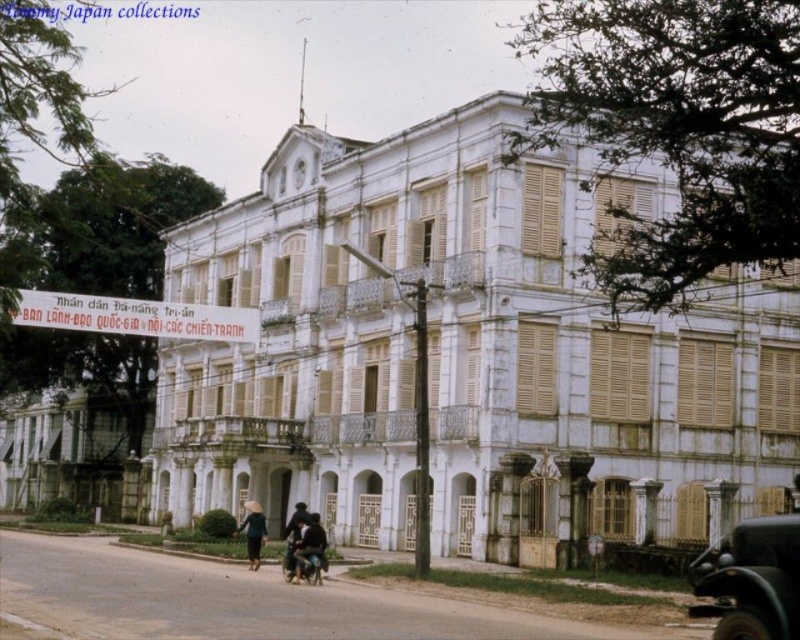
Question: Among these objects, which one is farthest from the camera?

Choices:
 (A) dark blue fabric hat at lower center
 (B) dark blue fabric jacket at center

Answer: (A)

Question: Observing the image, what is the correct spatial positioning of shiny black car at lower right in reference to dark blue fabric hat at lower center?

Choices:
 (A) below
 (B) above

Answer: (B)

Question: Is dark blue fabric jacket at center to the right of dark blue fabric hat at lower center from the viewer's perspective?

Choices:
 (A) yes
 (B) no

Answer: (A)

Question: Is white painted wood palace at center to the left of dark blue fabric hat at lower center from the viewer's perspective?

Choices:
 (A) no
 (B) yes

Answer: (A)

Question: Considering the real-world distances, which object is closest to the white painted wood palace at lower left?

Choices:
 (A) shiny black car at lower right
 (B) dark blue fabric jacket at center

Answer: (B)

Question: Estimate the real-world distances between objects in this image. Which object is closer to the dark blue fabric hat at lower center?

Choices:
 (A) dark blue fabric jacket at center
 (B) shiny black car at lower right
 (C) white painted wood palace at center

Answer: (A)